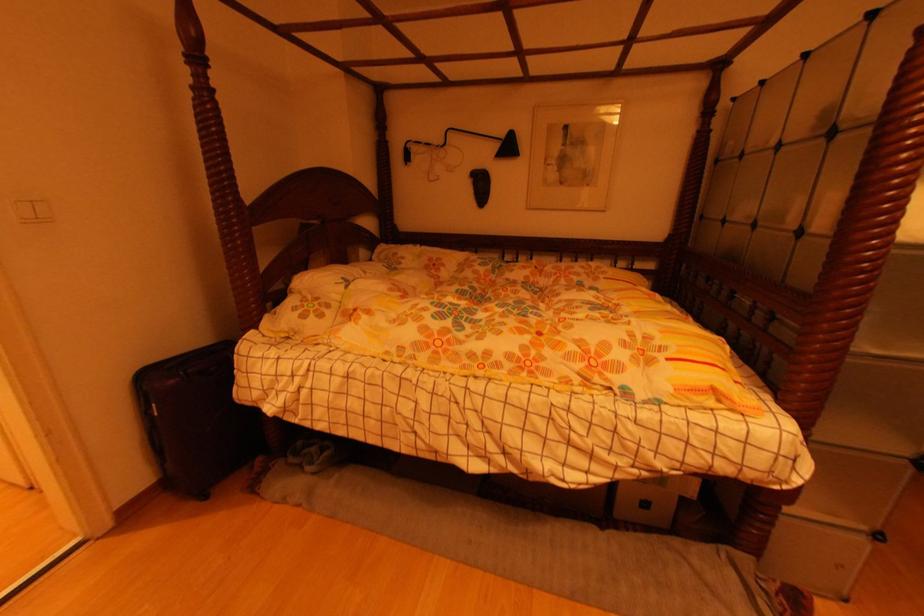
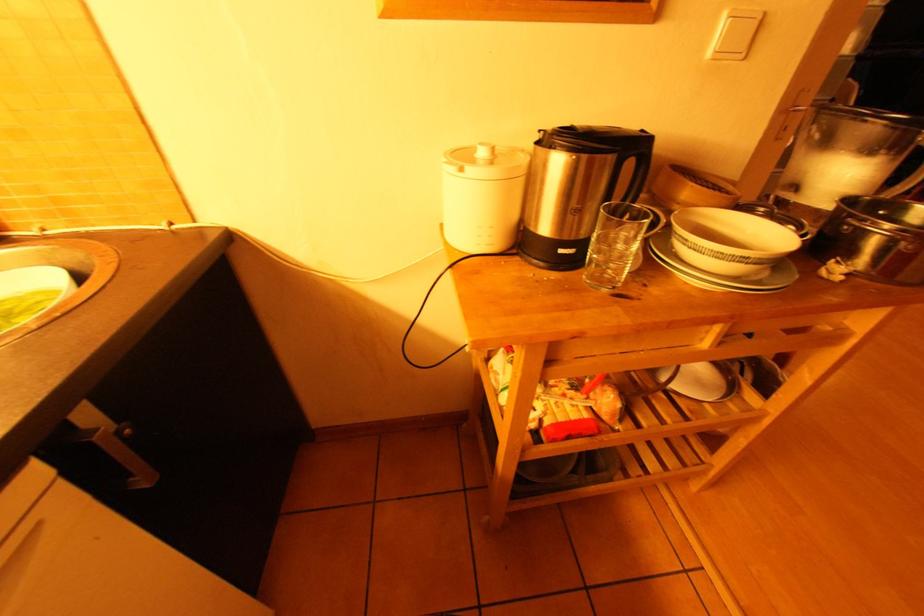
What movement of the cameraman would produce the second image?

The movement direction of the cameraman is left, backward.